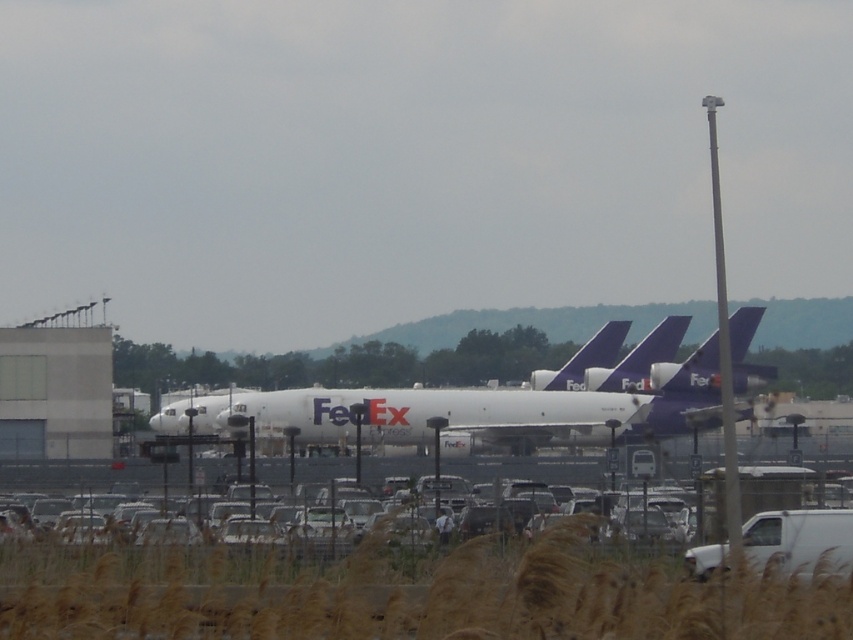
Question: Which point is closer to the camera taking this photo?

Choices:
 (A) (614, 532)
 (B) (410, 419)
 (C) (802, 561)

Answer: (C)

Question: Does white matte van at lower right lie in front of white matte car at lower center?

Choices:
 (A) yes
 (B) no

Answer: (A)

Question: Can you confirm if white matte van at lower right is thinner than white matte car at lower center?

Choices:
 (A) no
 (B) yes

Answer: (B)

Question: Is white matte van at lower right wider than white matte car at lower center?

Choices:
 (A) no
 (B) yes

Answer: (A)

Question: Which object is farther from the camera taking this photo?

Choices:
 (A) white matte car at lower center
 (B) white matte van at lower right

Answer: (A)

Question: Based on their relative distances, which object is nearer to the white matte van at lower right?

Choices:
 (A) white matte car at lower center
 (B) white matte fedex plane at center

Answer: (A)